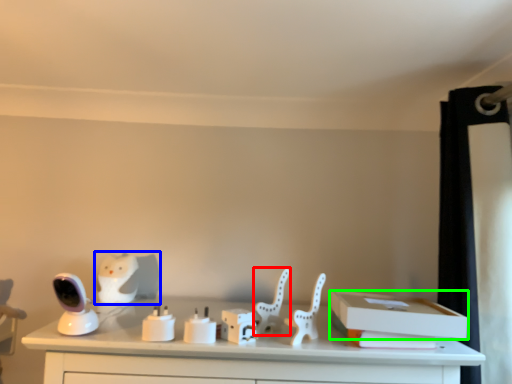
Question: Which object is positioned farthest from animal (highlighted by a red box)? Select from animal (highlighted by a blue box) and box (highlighted by a green box).

Choices:
 (A) animal
 (B) box

Answer: (A)